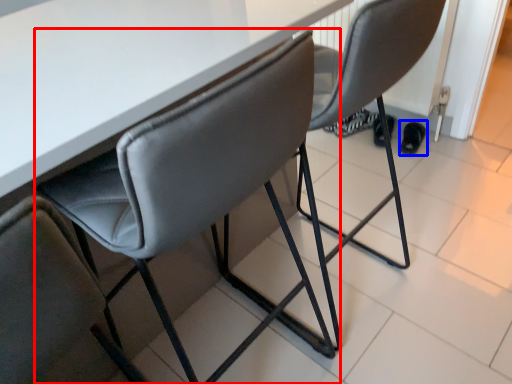
Question: Which object appears farthest to the camera in this image, chair (highlighted by a red box) or footwear (highlighted by a blue box)?

Choices:
 (A) chair
 (B) footwear

Answer: (B)